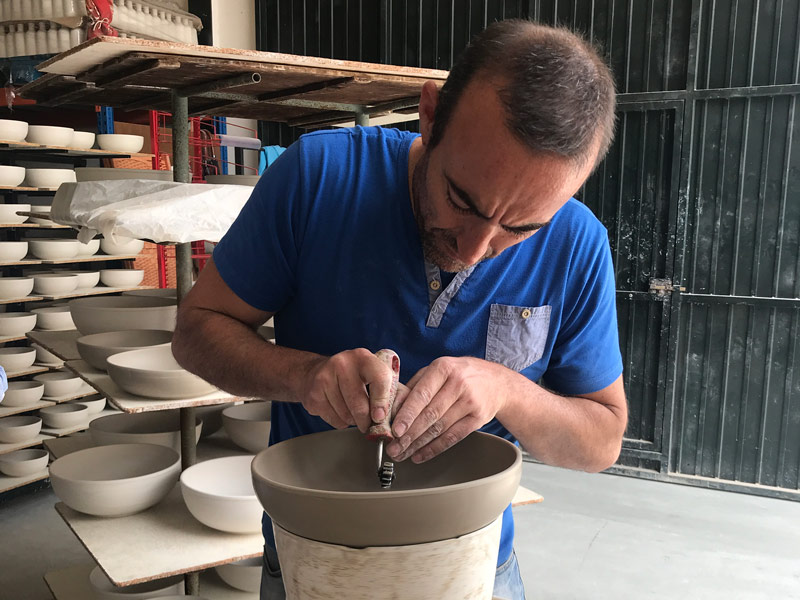
Find the location of a particular element. shelf is located at coordinates (61, 146).